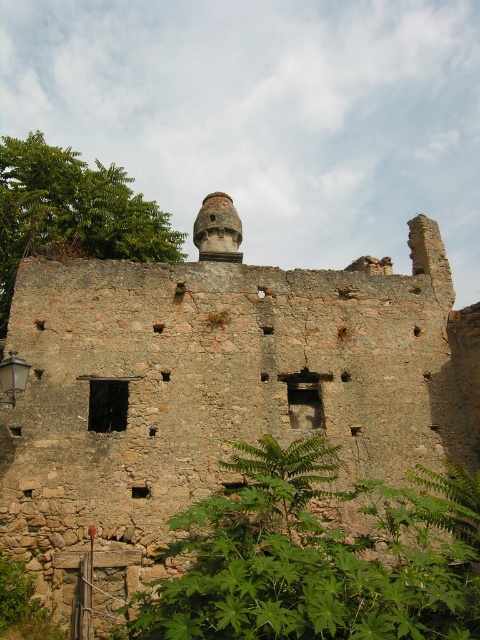
Question: Can you confirm if rustic stone ruins at center is positioned to the left of green leafy plant at lower center?

Choices:
 (A) yes
 (B) no

Answer: (A)

Question: Which of the following is the closest to the observer?

Choices:
 (A) green leafy plant at lower center
 (B) rustic stone ruins at center

Answer: (A)

Question: Which of these objects is positioned closest to the green leafy foliage at upper left?

Choices:
 (A) green leafy plant at lower center
 (B) rustic stone ruins at center

Answer: (B)

Question: From the image, what is the correct spatial relationship of rustic stone ruins at center in relation to green leafy plant at lower center?

Choices:
 (A) above
 (B) below

Answer: (A)

Question: Does rustic stone ruins at center have a greater width compared to green leafy plant at lower center?

Choices:
 (A) no
 (B) yes

Answer: (B)

Question: Among these objects, which one is farthest from the camera?

Choices:
 (A) green leafy plant at lower center
 (B) green leafy foliage at upper left
 (C) rustic stone ruins at center

Answer: (B)